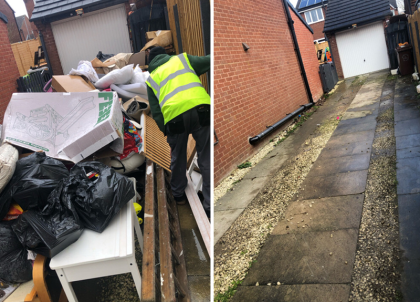
Find the location of a particular element. The height and width of the screenshot is (302, 420). cardboard box is located at coordinates (72, 85).